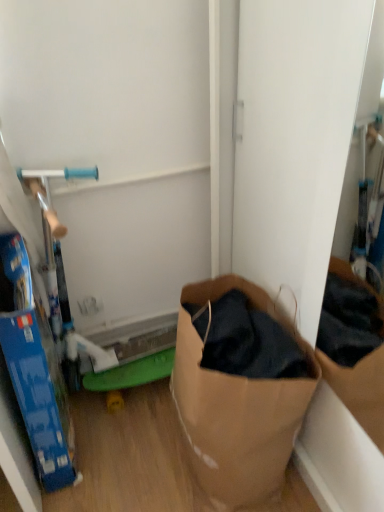
Measure the distance between point (13,314) and camera.

Point (13,314) and camera are 36.22 inches apart.

Find the location of `blue cardboard box at left`. blue cardboard box at left is located at coordinates (35, 368).

Describe the element at coordinates (35, 368) in the screenshot. The height and width of the screenshot is (512, 384). I see `blue cardboard box at left` at that location.

What is the approximate width of brown paper bag at lower right?

33.88 centimeters.

At what (x,y) coordinates should I click in order to perform the action: click on brown paper bag at lower right. Please return your answer as a coordinate pair (x, y). The image size is (384, 512). Looking at the image, I should click on (236, 408).

The image size is (384, 512). What do you see at coordinates (236, 408) in the screenshot?
I see `brown paper bag at lower right` at bounding box center [236, 408].

Image resolution: width=384 pixels, height=512 pixels. I want to click on blue cardboard box at left, so click(x=35, y=368).

Can you confirm if brown paper bag at lower right is positioned to the left of blue cardboard box at left?

No.

Does brown paper bag at lower right lie behind blue cardboard box at left?

Yes, it is.

Considering the positions of point (245, 289) and point (63, 434), is point (245, 289) closer or farther from the camera than point (63, 434)?

Clearly, point (245, 289) is more distant from the camera than point (63, 434).

From the image's perspective, is brown paper bag at lower right located beneath blue cardboard box at left?

Yes, from the image's perspective, brown paper bag at lower right is below blue cardboard box at left.

From a real-world perspective, between brown paper bag at lower right and blue cardboard box at left, who is vertically lower?

brown paper bag at lower right.

Can you confirm if brown paper bag at lower right is thinner than blue cardboard box at left?

Incorrect, the width of brown paper bag at lower right is not less than that of blue cardboard box at left.

Considering the sizes of brown paper bag at lower right and blue cardboard box at left in the image, is brown paper bag at lower right taller or shorter than blue cardboard box at left?

Considering their sizes, brown paper bag at lower right has less height than blue cardboard box at left.

Considering the relative sizes of brown paper bag at lower right and blue cardboard box at left in the image provided, is brown paper bag at lower right bigger than blue cardboard box at left?

Yes.

Is brown paper bag at lower right positioned beyond the bounds of blue cardboard box at left?

That's correct, brown paper bag at lower right is outside of blue cardboard box at left.

Is brown paper bag at lower right with blue cardboard box at left?

brown paper bag at lower right and blue cardboard box at left are not in contact.

Is brown paper bag at lower right looking in the opposite direction of blue cardboard box at left?

That's not correct — brown paper bag at lower right is not looking away from blue cardboard box at left.

Where is `box lying in front of the brown paper bag at lower right`? This screenshot has height=512, width=384. box lying in front of the brown paper bag at lower right is located at coordinates (35, 368).

Considering the positions of objects blue cardboard box at left and brown paper bag at lower right in the image provided, who is more to the left, blue cardboard box at left or brown paper bag at lower right?

blue cardboard box at left is more to the left.

In the scene shown: Which object is closer to the camera taking this photo, blue cardboard box at left or brown paper bag at lower right?

blue cardboard box at left is more forward.

Is point (21, 247) closer to viewer compared to point (203, 377)?

That is False.

From the image's perspective, which one is positioned higher, blue cardboard box at left or brown paper bag at lower right?

blue cardboard box at left appears higher in the image.

Based on the photo, from a real-world perspective, who is located lower, blue cardboard box at left or brown paper bag at lower right?

In real-world perspective, brown paper bag at lower right is lower.

Can you confirm if blue cardboard box at left is thinner than brown paper bag at lower right?

Yes, blue cardboard box at left is thinner than brown paper bag at lower right.

From the picture: Considering the sizes of objects blue cardboard box at left and brown paper bag at lower right in the image provided, who is shorter, blue cardboard box at left or brown paper bag at lower right?

With less height is brown paper bag at lower right.

Considering the relative sizes of blue cardboard box at left and brown paper bag at lower right in the image provided, is blue cardboard box at left smaller than brown paper bag at lower right?

Yes.

Is blue cardboard box at left completely or partially outside of brown paper bag at lower right?

Yes.

Is blue cardboard box at left not close to brown paper bag at lower right?

blue cardboard box at left is near brown paper bag at lower right, not far away.

Does blue cardboard box at left turn towards brown paper bag at lower right?

Yes, blue cardboard box at left is aimed at brown paper bag at lower right.

How different are the orientations of blue cardboard box at left and brown paper bag at lower right in degrees?

The angle between the facing direction of blue cardboard box at left and the facing direction of brown paper bag at lower right is 177 degrees.

Locate an element on the screen. box that is above the brown paper bag at lower right (from the image's perspective) is located at coordinates (35, 368).

Locate an element on the screen. Image resolution: width=384 pixels, height=512 pixels. box above the brown paper bag at lower right (from the image's perspective) is located at coordinates (35, 368).

Image resolution: width=384 pixels, height=512 pixels. I want to click on box that appears above the brown paper bag at lower right (from a real-world perspective), so click(35, 368).